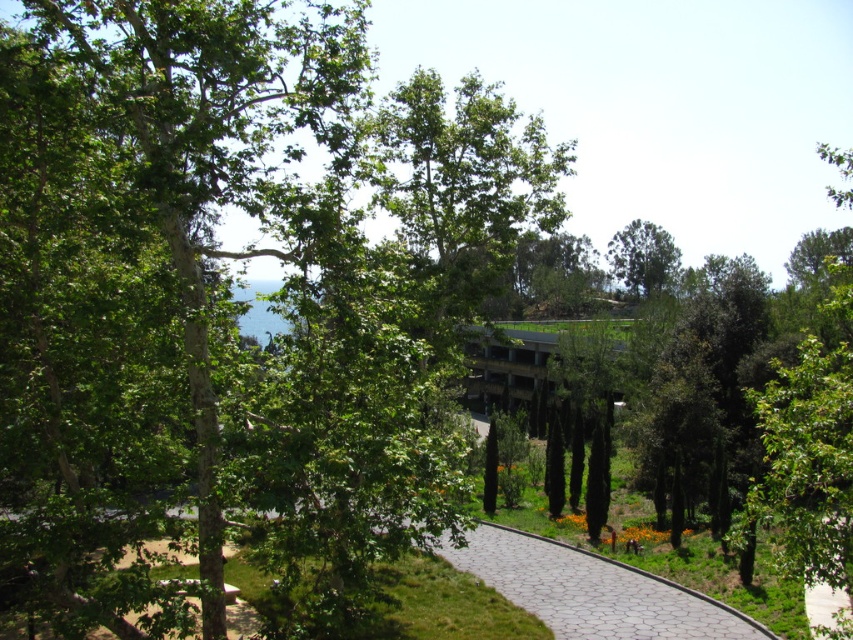
Can you confirm if green leafy tree at left is positioned above paved stone path at center?

Indeed, green leafy tree at left is positioned over paved stone path at center.

Does point (310, 70) lie behind point (624, 592)?

No, (310, 70) is in front of (624, 592).

You are a GUI agent. You are given a task and a screenshot of the screen. Output one action in this format:
    pyautogui.click(x=<x>, y=<y>)
    Task: Click on the green leafy tree at left
    Image resolution: width=853 pixels, height=640 pixels.
    Given the screenshot: What is the action you would take?
    pyautogui.click(x=178, y=205)

Is point (225, 17) farther from viewer compared to point (640, 228)?

That is False.

Does point (61, 353) come in front of point (677, 259)?

That is True.

This screenshot has height=640, width=853. What are the coordinates of `green leafy tree at left` in the screenshot? It's located at (178, 205).

Can you confirm if paved stone path at center is shorter than green leafy tree at upper center?

Correct, paved stone path at center is not as tall as green leafy tree at upper center.

Can you confirm if paved stone path at center is positioned to the left of green leafy tree at upper center?

Yes, paved stone path at center is to the left of green leafy tree at upper center.

Does point (405, 618) come closer to viewer compared to point (664, 288)?

Yes, it is in front of point (664, 288).

Identify the location of paved stone path at center. (572, 592).